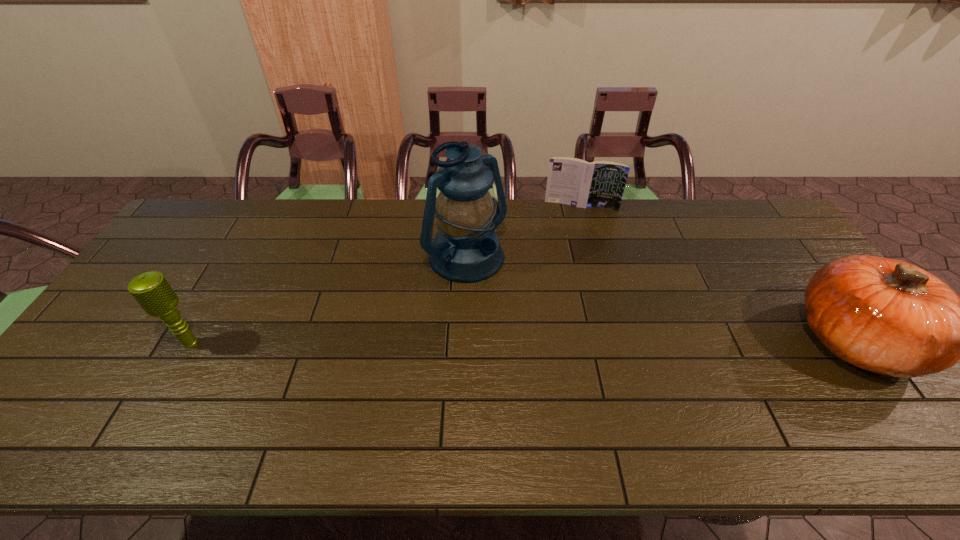
What are the coordinates of `the leftmost object` in the screenshot? It's located at (151, 290).

Find the location of `the tallest object`. the tallest object is located at coordinates (466, 249).

You are a GUI agent. You are given a task and a screenshot of the screen. Output one action in this format:
    pyautogui.click(x=<x>, y=<y>)
    Task: Click on the lantern
    This screenshot has height=540, width=960.
    Given the screenshot: What is the action you would take?
    pyautogui.click(x=466, y=249)

You are a GUI agent. You are given a task and a screenshot of the screen. Output one action in this format:
    pyautogui.click(x=<x>, y=<y>)
    Task: Click on the second object from right to left
    The image size is (960, 540).
    Given the screenshot: What is the action you would take?
    pyautogui.click(x=600, y=184)

At what (x,y) coordinates should I click in order to perform the action: click on the farthest object. Please return your answer as a coordinate pair (x, y). Looking at the image, I should click on point(600,184).

In order to click on free space located 0.080m on the front of the leftmost object in this screenshot , I will do (170, 382).

Where is `free region located on the face of the tallest object`? free region located on the face of the tallest object is located at coordinates (537, 334).

Locate an element on the screen. This screenshot has width=960, height=540. free space located on the face of the tallest object is located at coordinates (516, 313).

This screenshot has width=960, height=540. I want to click on free region located on the face of the tallest object, so click(x=563, y=359).

Where is `free spot located 0.050m on the front cover of the farthest object`? free spot located 0.050m on the front cover of the farthest object is located at coordinates (574, 220).